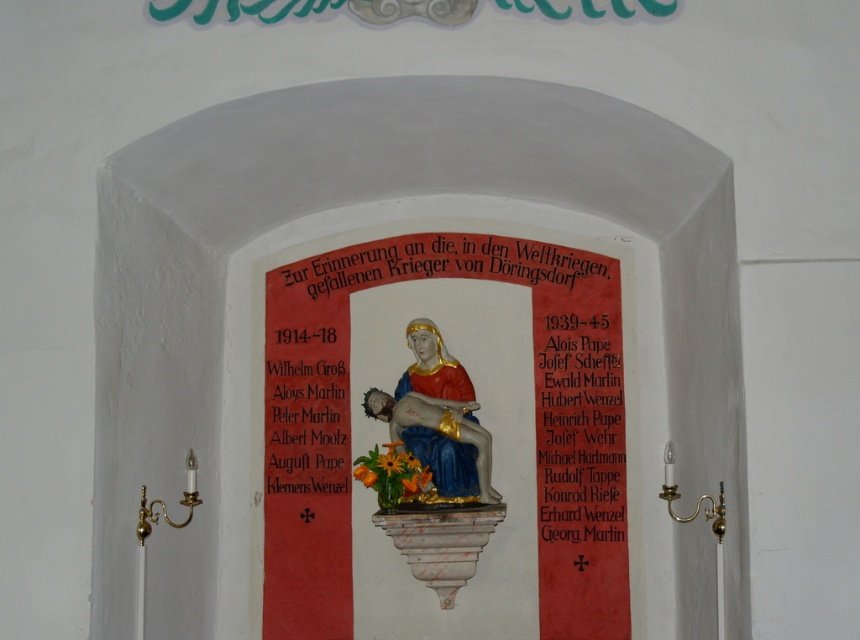
Question: Can you confirm if gold metallic plaque at center is wider than polychrome ceramic statue at center?

Choices:
 (A) no
 (B) yes

Answer: (B)

Question: Is black paper at right above polychrome ceramic statue at center?

Choices:
 (A) yes
 (B) no

Answer: (B)

Question: Which of the following is the closest to the observer?

Choices:
 (A) (x=352, y=257)
 (B) (x=347, y=442)

Answer: (B)

Question: Does gold metallic plaque at center lie in front of matte gold text at left?

Choices:
 (A) yes
 (B) no

Answer: (B)

Question: Which point is closer to the camera?

Choices:
 (A) (306, 476)
 (B) (551, 483)
 (C) (446, 268)
 (D) (430, 371)

Answer: (D)

Question: Among these objects, which one is farthest from the camera?

Choices:
 (A) gold metallic plaque at center
 (B) matte gold text at left
 (C) polychrome ceramic statue at center
 (D) black paper at right

Answer: (A)